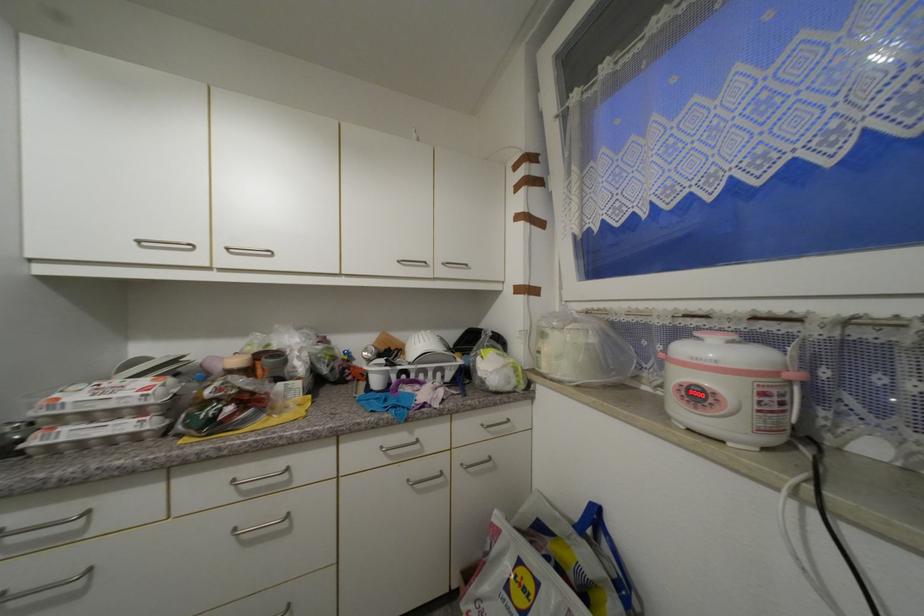
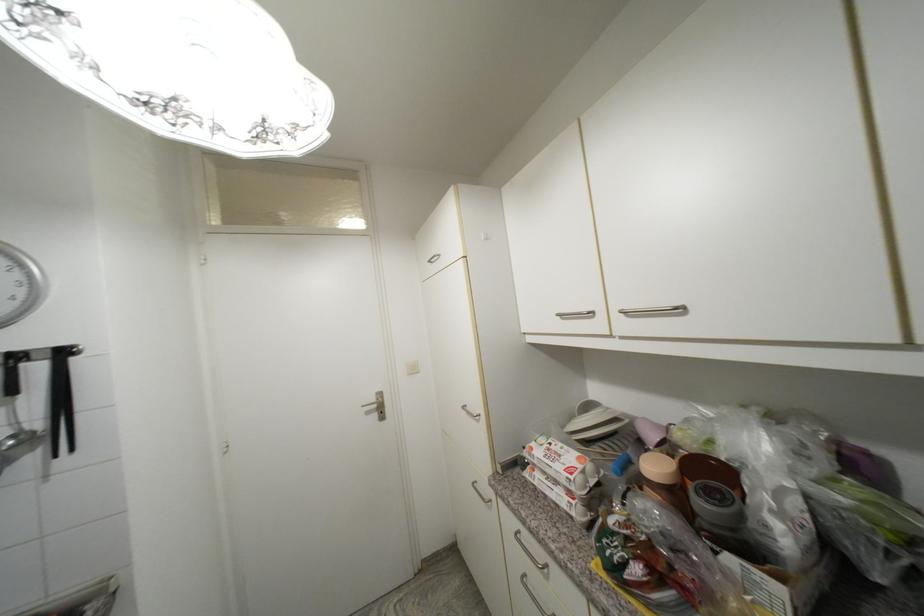
Find the pixel in the second image that matches [196,246] in the first image.

(594, 314)